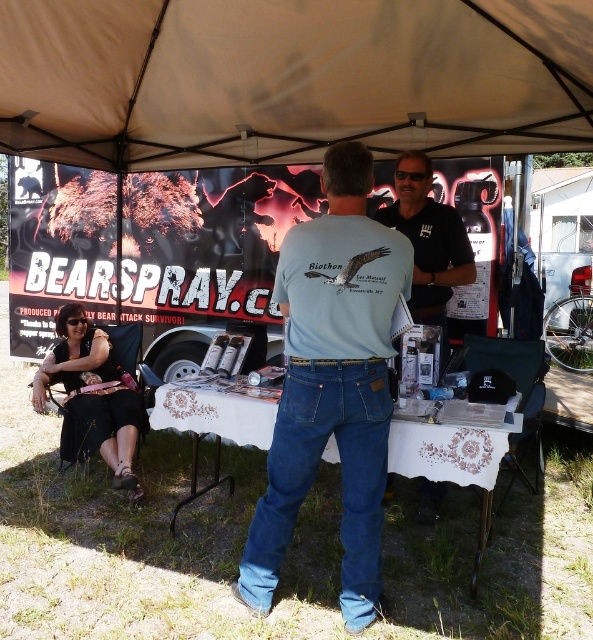
Question: Can you confirm if light blue cotton t-shirt at center is positioned to the right of black leather jacket at lower left?

Choices:
 (A) yes
 (B) no

Answer: (A)

Question: Is light blue cotton t-shirt at center to the right of black leather jacket at lower left from the viewer's perspective?

Choices:
 (A) no
 (B) yes

Answer: (B)

Question: Does white lace tablecloth at center have a greater width compared to black matte shirt at center?

Choices:
 (A) yes
 (B) no

Answer: (A)

Question: Which object is closer to the camera taking this photo?

Choices:
 (A) beige fabric canopy at upper center
 (B) light blue cotton t-shirt at center
 (C) white lace tablecloth at center

Answer: (B)

Question: Which of the following is the closest to the observer?

Choices:
 (A) beige fabric canopy at upper center
 (B) light blue cotton t-shirt at center
 (C) black matte shirt at center

Answer: (B)

Question: Among these objects, which one is nearest to the camera?

Choices:
 (A) black leather jacket at lower left
 (B) light blue cotton t-shirt at center
 (C) white lace tablecloth at center

Answer: (B)